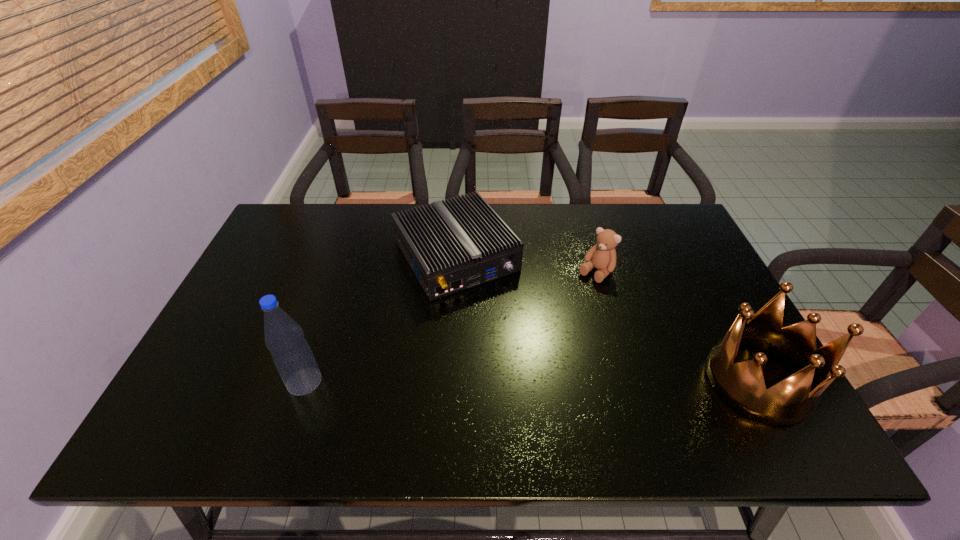
Where is `free space in the image that satisfies the following two spatial constraints: 1. on the front side of the teddy bear; 2. on the left side of the third shortest object`? The image size is (960, 540). free space in the image that satisfies the following two spatial constraints: 1. on the front side of the teddy bear; 2. on the left side of the third shortest object is located at coordinates (626, 380).

Locate an element on the screen. The width and height of the screenshot is (960, 540). free location that satisfies the following two spatial constraints: 1. on the front side of the third object from left to right; 2. on the right side of the second tallest object is located at coordinates (626, 380).